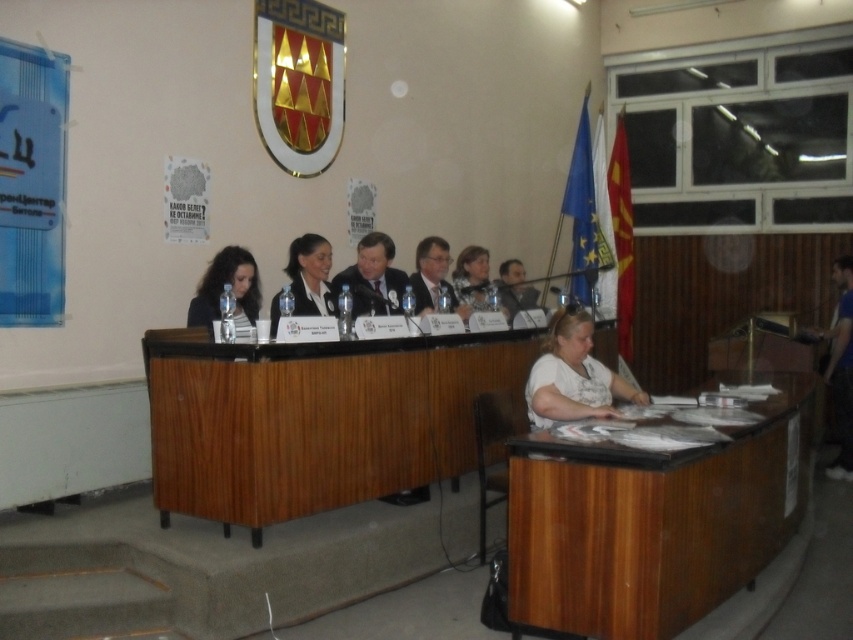
Question: Estimate the real-world distances between objects in this image. Which object is closer to the light brown wood chair at center?

Choices:
 (A) wooden table at lower right
 (B) matte black suit at center
 (C) matte black shirt at center
 (D) matte black hair at left

Answer: (B)

Question: Can you confirm if matte black suit at center is positioned to the left of matte black jacket at upper center?

Choices:
 (A) yes
 (B) no

Answer: (A)

Question: Does wooden table at lower right appear over matte black shirt at center?

Choices:
 (A) no
 (B) yes

Answer: (A)

Question: Among these points, which one is nearest to the camera?

Choices:
 (A) (619, 556)
 (B) (241, 278)
 (C) (454, 284)

Answer: (A)

Question: Which of these objects is positioned closest to the matte black suit at center?

Choices:
 (A) white matte shirt at lower right
 (B) matte black hair at left
 (C) matte black shirt at center
 (D) light brown wood chair at center

Answer: (D)

Question: Observing the image, what is the correct spatial positioning of wooden table at lower right in reference to matte black suit at center?

Choices:
 (A) below
 (B) above

Answer: (A)